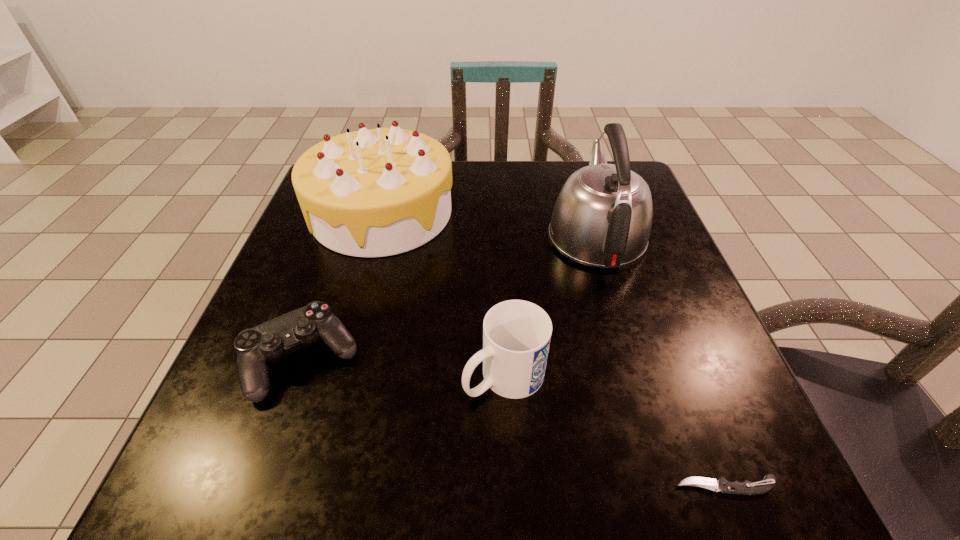
Where is `free space that is in between the nearest object and the birthday cake`? Image resolution: width=960 pixels, height=540 pixels. free space that is in between the nearest object and the birthday cake is located at coordinates (554, 349).

Locate an element on the screen. free point between the mug and the pocketknife is located at coordinates (615, 431).

Find the location of a particular element. Image resolution: width=960 pixels, height=540 pixels. vacant region between the tallest object and the fourth shortest object is located at coordinates (489, 225).

Find the location of a particular element. vacant point located between the control and the third object from right to left is located at coordinates (403, 368).

Find the location of a particular element. vacant area that lies between the third object from left to right and the nearest object is located at coordinates (615, 431).

Find the location of a particular element. vacant space that is in between the mug and the tallest object is located at coordinates (550, 306).

The height and width of the screenshot is (540, 960). What are the coordinates of `vacant area that lies between the pocketknife and the tallest object` in the screenshot? It's located at (661, 361).

Where is `vacant area between the tallest object and the nearest object`? Image resolution: width=960 pixels, height=540 pixels. vacant area between the tallest object and the nearest object is located at coordinates (661, 361).

The width and height of the screenshot is (960, 540). What are the coordinates of `object that ranks as the second closest to the pocketknife` in the screenshot? It's located at (602, 217).

At what (x,y) coordinates should I click in order to perform the action: click on object identified as the third closest to the control. Please return your answer as a coordinate pair (x, y). The height and width of the screenshot is (540, 960). Looking at the image, I should click on (602, 217).